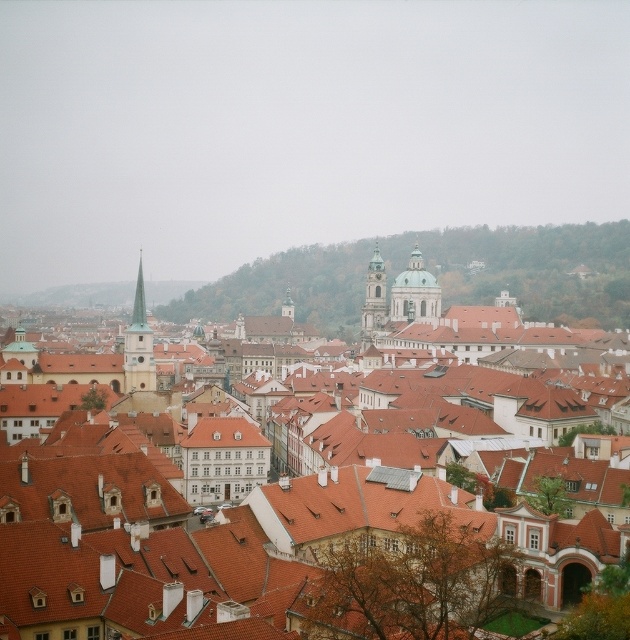
Is point (139, 276) farther from viewer compared to point (382, 260)?

That is False.

Between smooth white spire at center-left and smooth stone tower at center, which one appears on the right side from the viewer's perspective?

smooth stone tower at center

Is point (152, 356) positioned after point (370, 314)?

No, it is in front of (370, 314).

The image size is (630, 640). Find the location of `smooth white spire at center-left`. smooth white spire at center-left is located at coordinates (139, 344).

Does gold domed tower at center have a smaller size compared to green glass spire at center?

Yes, gold domed tower at center is smaller than green glass spire at center.

Is point (396, 288) positioned behind point (142, 300)?

Yes, point (396, 288) is behind point (142, 300).

Who is more distant from viewer, (430, 298) or (142, 292)?

The point (430, 298) is more distant.

Identify the location of gold domed tower at center. (415, 292).

Does smooth white spire at center-left come in front of green glass spire at center?

Yes.

Which is behind, point (127, 333) or point (144, 312)?

The point (144, 312) is behind.

Identify the location of smooth white spire at center-left. (139, 344).